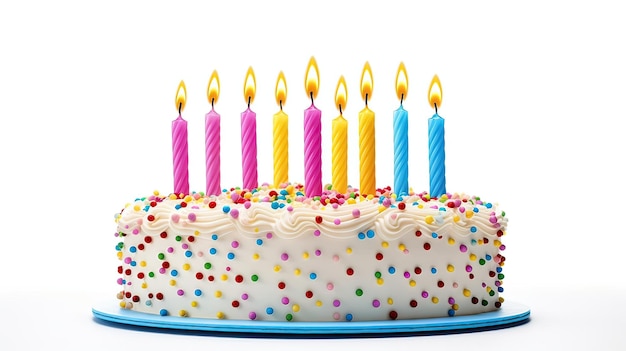
At what (x,y) coordinates should I click in order to perform the action: click on candle wicks. Please return your answer as a coordinate pair (x, y). The image size is (626, 351). Looking at the image, I should click on (434, 108), (402, 99), (364, 99), (340, 108), (309, 99), (280, 106), (250, 100), (210, 102), (178, 108).